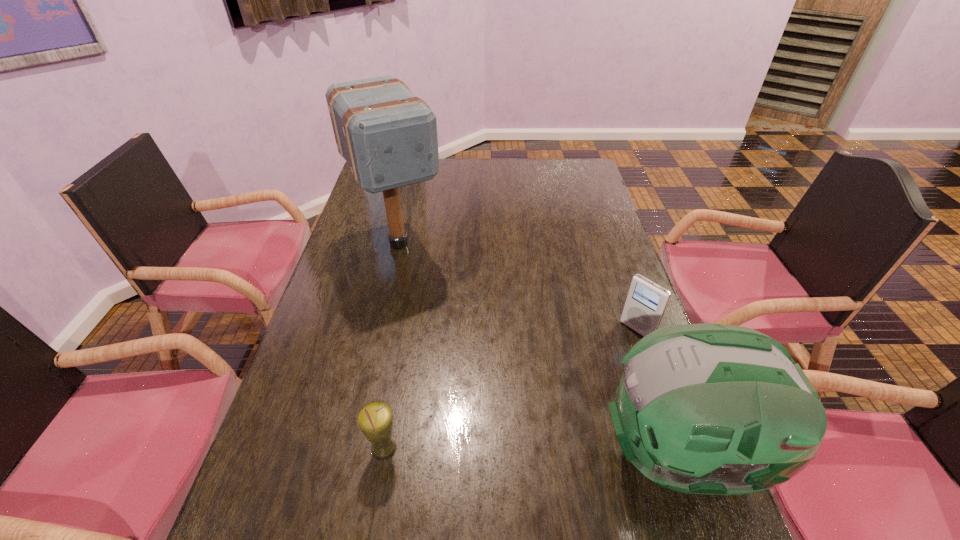
Identify the location of free space located 0.220m on the striking surface of the farthest object. This screenshot has height=540, width=960. (444, 325).

This screenshot has width=960, height=540. I want to click on vacant space located 0.330m on the striking surface of the farthest object, so [x=461, y=354].

Locate an element on the screen. free spot located 0.380m on the striking surface of the farthest object is located at coordinates (469, 369).

Identify the location of object situated at the near edge. (715, 409).

You are a GUI agent. You are given a task and a screenshot of the screen. Output one action in this format:
    pyautogui.click(x=<x>, y=<y>)
    Task: Click on the object at the left edge
    This screenshot has width=960, height=540.
    Given the screenshot: What is the action you would take?
    pyautogui.click(x=388, y=136)

Locate an element on the screen. football helmet located in the right edge section of the desktop is located at coordinates (715, 409).

Image resolution: width=960 pixels, height=540 pixels. Find the location of `iPod present at the right edge`. iPod present at the right edge is located at coordinates (646, 302).

Locate an element on the screen. This screenshot has width=960, height=540. object that is at the near right corner is located at coordinates (715, 409).

The height and width of the screenshot is (540, 960). What are the coordinates of `vacant space at the far edge of the desktop` in the screenshot? It's located at (528, 177).

You are a GUI agent. You are given a task and a screenshot of the screen. Output one action in this format:
    pyautogui.click(x=<x>, y=<y>)
    Task: Click on the vacant area at the left edge
    
    Given the screenshot: What is the action you would take?
    pyautogui.click(x=373, y=262)